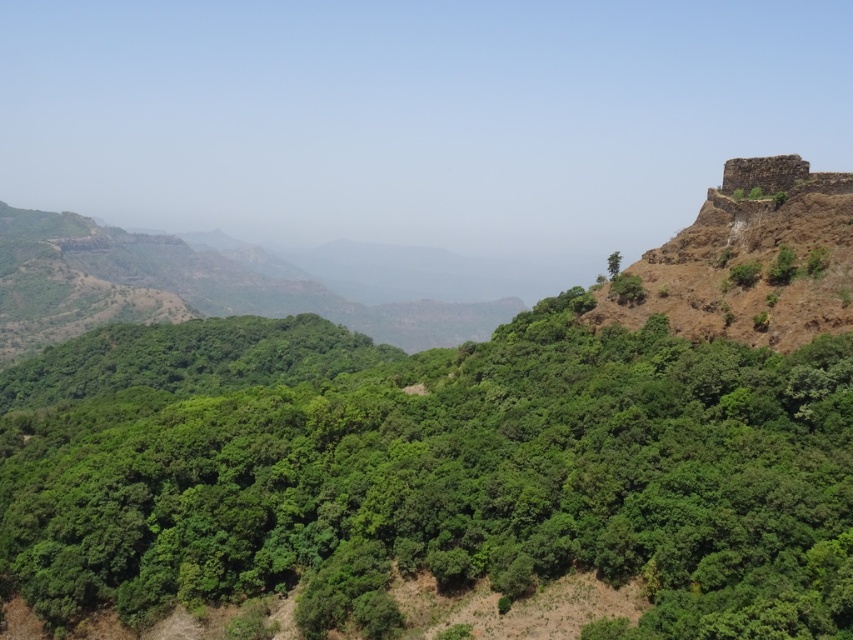
Does green leafy trees at center have a greater width compared to rustic stone fort at upper right?

Correct, the width of green leafy trees at center exceeds that of rustic stone fort at upper right.

Who is taller, green leafy trees at center or rustic stone fort at upper right?

With more height is green leafy trees at center.

Who is more distant from viewer, (219, 589) or (732, 172)?

The point (732, 172) is more distant.

Where is `green leafy trees at center`? The image size is (853, 640). green leafy trees at center is located at coordinates (428, 472).

Can you confirm if green leafy trees at center is positioned to the right of green leafy tree at upper right?

Incorrect, green leafy trees at center is not on the right side of green leafy tree at upper right.

Is point (306, 557) farther from camera compared to point (614, 259)?

No, (306, 557) is closer to viewer.

At what (x,y) coordinates should I click in order to perform the action: click on green leafy trees at center. Please return your answer as a coordinate pair (x, y). The width and height of the screenshot is (853, 640). Looking at the image, I should click on (428, 472).

Can you confirm if rustic stone fort at upper right is positioned below green leafy tree at upper right?

Incorrect, rustic stone fort at upper right is not positioned below green leafy tree at upper right.

Can you confirm if rustic stone fort at upper right is bigger than green leafy tree at upper right?

Actually, rustic stone fort at upper right might be smaller than green leafy tree at upper right.

Is point (756, 170) less distant than point (607, 262)?

Yes, point (756, 170) is closer to viewer.

Identify the location of rustic stone fort at upper right. This screenshot has width=853, height=640. (763, 173).